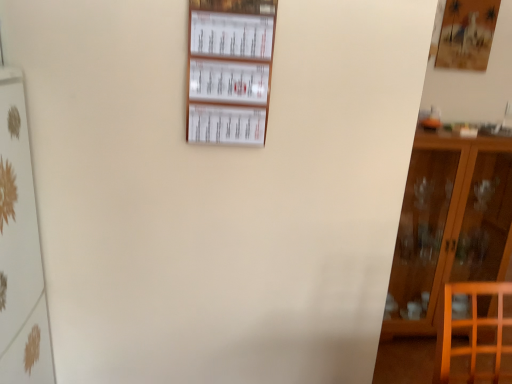
Question: From the image's perspective, relative to brown wooden cabinet at right, is white paperboard at upper center, positioned as the 2th shelf in bottom-to-top order, above or below?

Choices:
 (A) below
 (B) above

Answer: (B)

Question: From a real-world perspective, is white paperboard at upper center, positioned as the 2th shelf in bottom-to-top order, positioned above or below brown wooden cabinet at right?

Choices:
 (A) above
 (B) below

Answer: (A)

Question: Which object is the closest to the white glossy shelf at left, which is the first shelf from bottom to top?

Choices:
 (A) white paperboard at upper center, positioned as the 1th shelf in right-to-left order
 (B) brown wooden cabinet at right

Answer: (A)

Question: Which object is the closest to the white paperboard at upper center, which is the 1th shelf from top to bottom?

Choices:
 (A) brown wooden cabinet at right
 (B) white glossy shelf at left, which is the first shelf from bottom to top

Answer: (B)